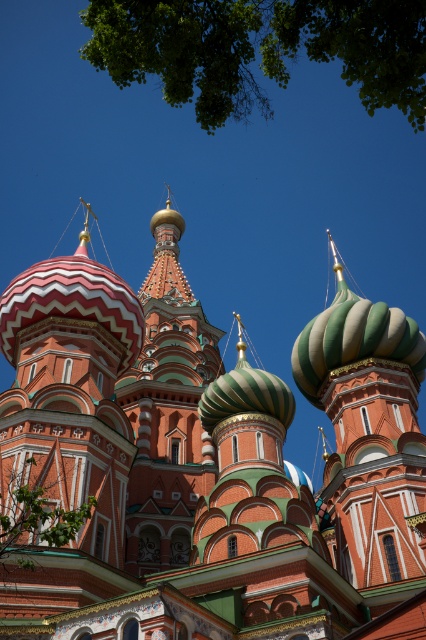
Question: Which of the following is the closest to the observer?

Choices:
 (A) green leafy tree at upper center
 (B) green glossy dome at center
 (C) polished red brick tower at center
 (D) red and white striped dome at center

Answer: (A)

Question: Which object appears closest to the camera in this image?

Choices:
 (A) green leafy tree at lower left
 (B) green glossy dome at center
 (C) red and white striped dome at center
 (D) polished red brick tower at center

Answer: (A)

Question: Which object is closer to the camera taking this photo?

Choices:
 (A) green leafy tree at upper center
 (B) polychrome mosaic dome at center

Answer: (A)

Question: Is polychrome mosaic dome at center in front of green glossy dome at center?

Choices:
 (A) yes
 (B) no

Answer: (A)

Question: Does green leafy tree at upper center have a lesser width compared to green leafy tree at lower left?

Choices:
 (A) no
 (B) yes

Answer: (A)

Question: Does polished red brick tower at center appear on the left side of green glossy dome at center?

Choices:
 (A) no
 (B) yes

Answer: (B)